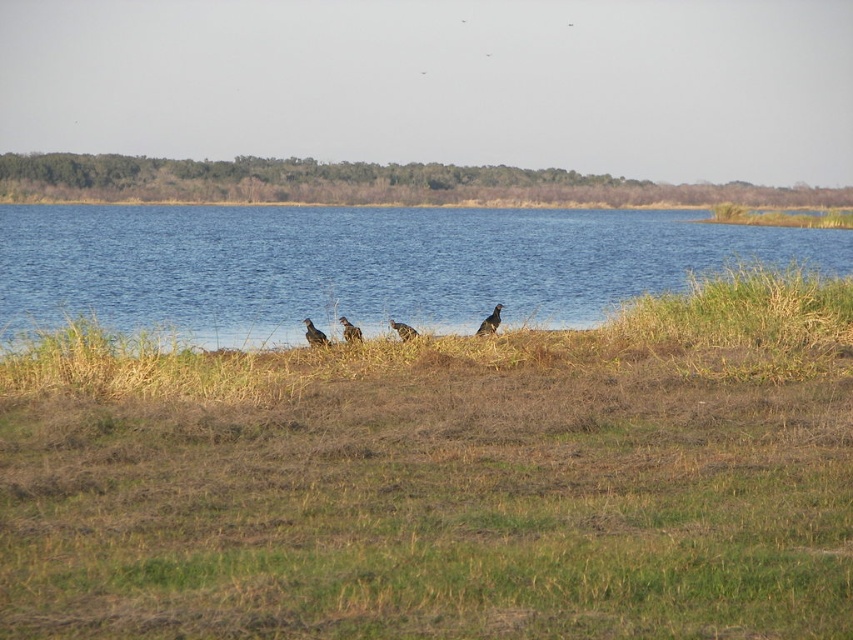
Between gray feathered bird at center and brown speckled feathered bird at center, which one appears on the right side from the viewer's perspective?

From the viewer's perspective, brown speckled feathered bird at center appears more on the right side.

Who is lower down, gray feathered bird at center or brown speckled feathered bird at center?

gray feathered bird at center is lower down.

Consider the image. Who is more forward, (347, 321) or (410, 337)?

Point (410, 337) is in front.

Identify the location of gray feathered bird at center. This screenshot has width=853, height=640. (350, 330).

In the scene shown: Can you confirm if brown dry grass at center is bigger than brown speckled feathered bird at center?

Yes, brown dry grass at center is bigger than brown speckled feathered bird at center.

Between brown dry grass at center and brown speckled feathered bird at center, which one has less height?

Standing shorter between the two is brown speckled feathered bird at center.

Is point (379, 387) farther from viewer compared to point (393, 326)?

No, (379, 387) is closer to viewer.

This screenshot has height=640, width=853. I want to click on brown dry grass at center, so click(x=444, y=477).

Who is lower down, dark gray feathers at center or gray feathered bird at center?

dark gray feathers at center is lower down.

Does point (328, 342) come behind point (346, 321)?

That is False.

Where is `dark gray feathers at center`? The height and width of the screenshot is (640, 853). dark gray feathers at center is located at coordinates (314, 333).